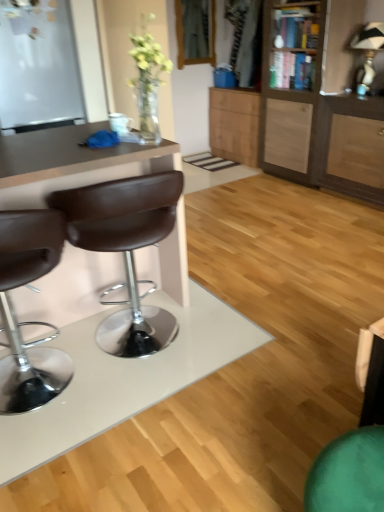
Find the location of `vacant area that is situated to the right of brown leather stool at left, which appears as the 2th chair when viewed from the left`. vacant area that is situated to the right of brown leather stool at left, which appears as the 2th chair when viewed from the left is located at coordinates (238, 335).